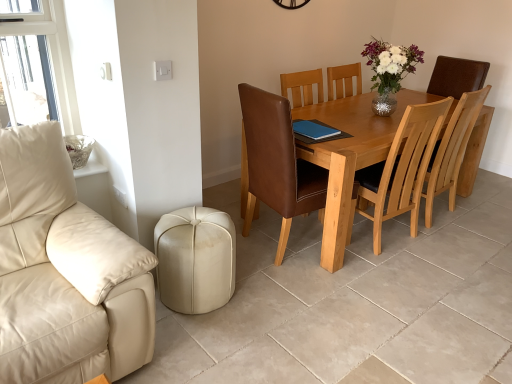
Where is `unoccupied region to the right of light brown wood chair at center, which ranks as the second chair in left-to-right order`? unoccupied region to the right of light brown wood chair at center, which ranks as the second chair in left-to-right order is located at coordinates (479, 218).